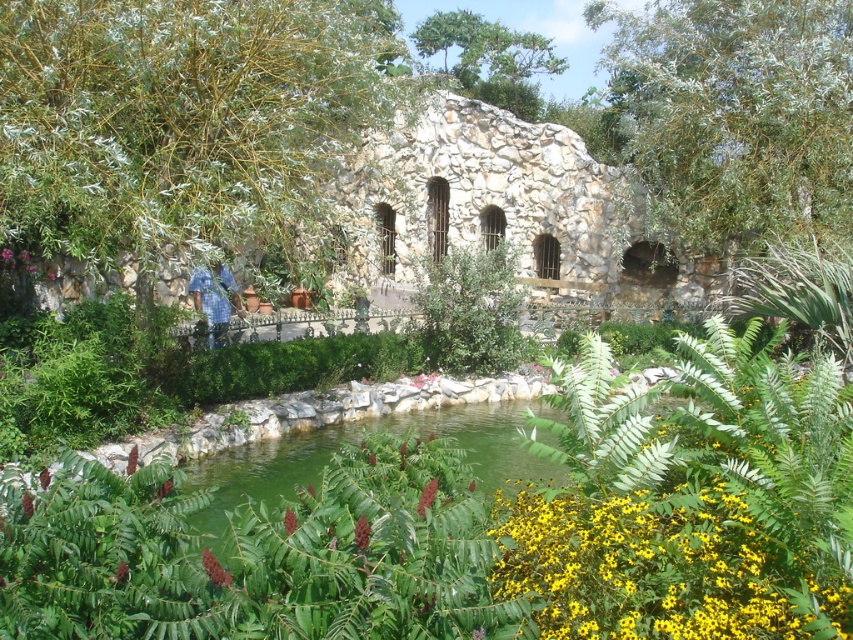
Between point (212, 340) and point (206, 570), which one is positioned behind?

The point (212, 340) is behind.

What do you see at coordinates (213, 300) in the screenshot?
I see `blue plaid shirt at center` at bounding box center [213, 300].

Identify the location of blue plaid shirt at center. Image resolution: width=853 pixels, height=640 pixels. (213, 300).

The width and height of the screenshot is (853, 640). What do you see at coordinates (659, 568) in the screenshot? I see `yellow matte flower at lower right` at bounding box center [659, 568].

Who is more distant from viewer, (715,580) or (421,508)?

The point (715,580) is more distant.

Does point (641, 612) come behind point (426, 488)?

No.

Find the location of a particular element. yellow matte flower at lower right is located at coordinates (659, 568).

Identify the location of red matte flower at center. The height and width of the screenshot is (640, 853). (213, 570).

Does red matte flower at center appear over purple matte flower at center?

Actually, red matte flower at center is below purple matte flower at center.

At what (x,y) coordinates should I click in order to perform the action: click on red matte flower at center. Please return your answer as a coordinate pair (x, y). The image size is (853, 640). Looking at the image, I should click on (213, 570).